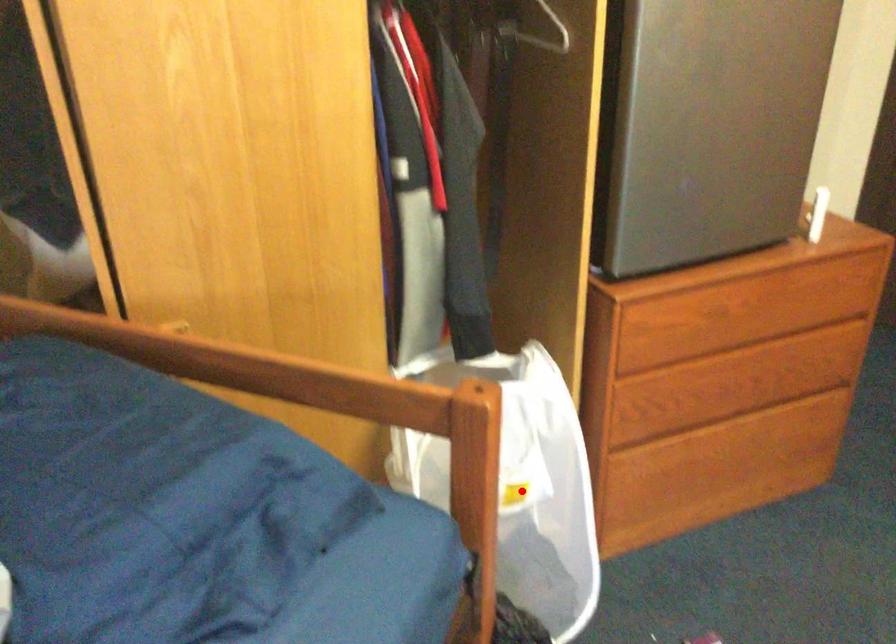
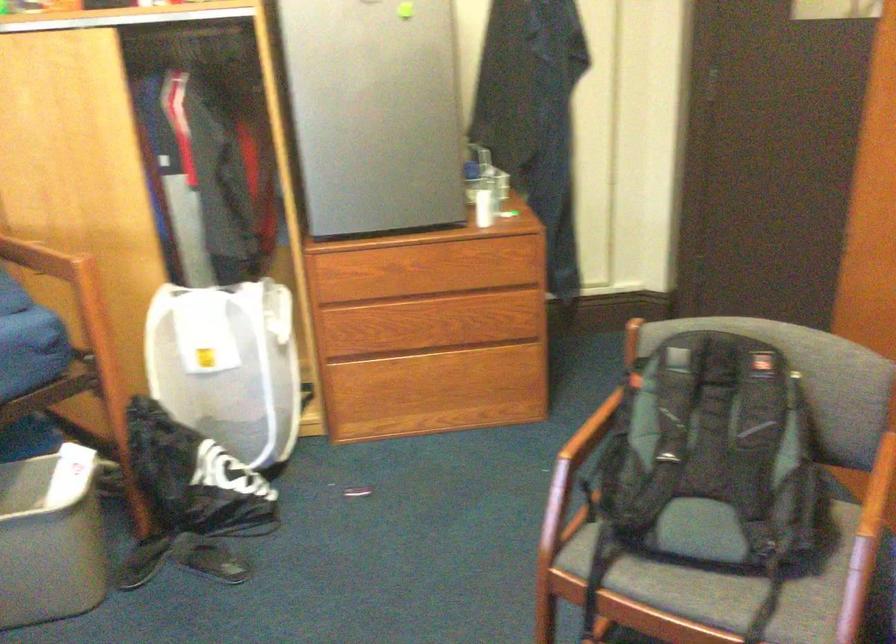
Question: A red point is marked in image1. In image2, is the corresponding 3D point closer to the camera or farther? Reply with the corresponding letter.

Choices:
 (A) The corresponding 3D point is closer.
 (B) The corresponding 3D point is farther.

Answer: (B)